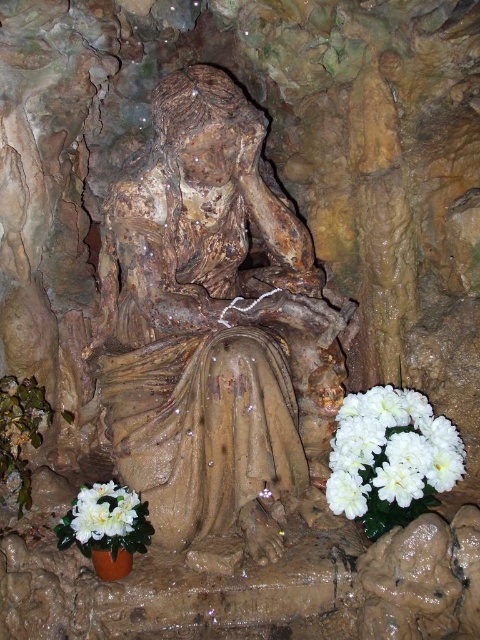
You are an artist standing in front of the statue and you want to place a new flower arrangement between the white matte flower at lower right and the white silk flower at lower left. Based on their positions, which flower should you place your new arrangement closer to?

The white matte flower at lower right is positioned over the white silk flower at lower left, so you should place the new arrangement closer to the white silk flower at lower left to maintain the spatial hierarchy.

You are an archaeologist examining the image of a cave with a statue. Where is the brown stone statue at center located in terms of its 2D coordinates?

The brown stone statue at center is located at the 2D coordinates of point (214, 324).

You are an interior designer arranging a living room. You have a brown stone statue at center and white artificial flowers at lower left. Based on the scene, which object is positioned to the right of the other?

The brown stone statue at center is positioned to the right of the white artificial flowers at lower left.